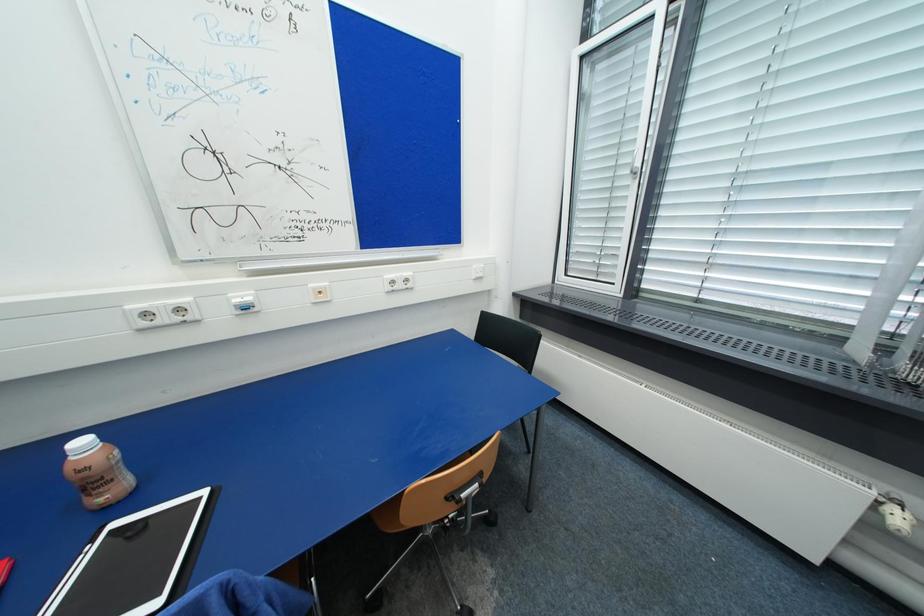
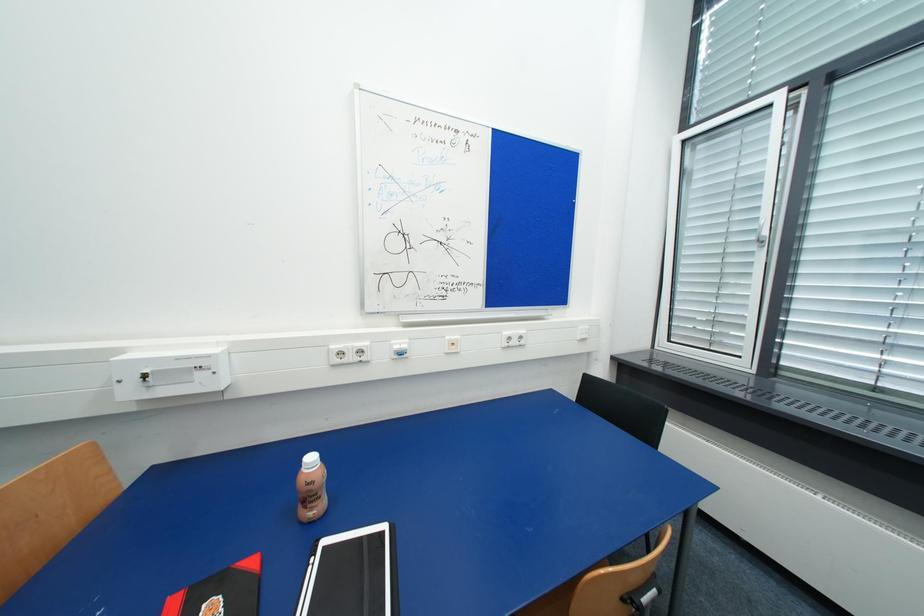
Question: What movement of the cameraman would produce the second image?

Choices:
 (A) Left
 (B) Right
 (C) Forward
 (D) Backward

Answer: (A)